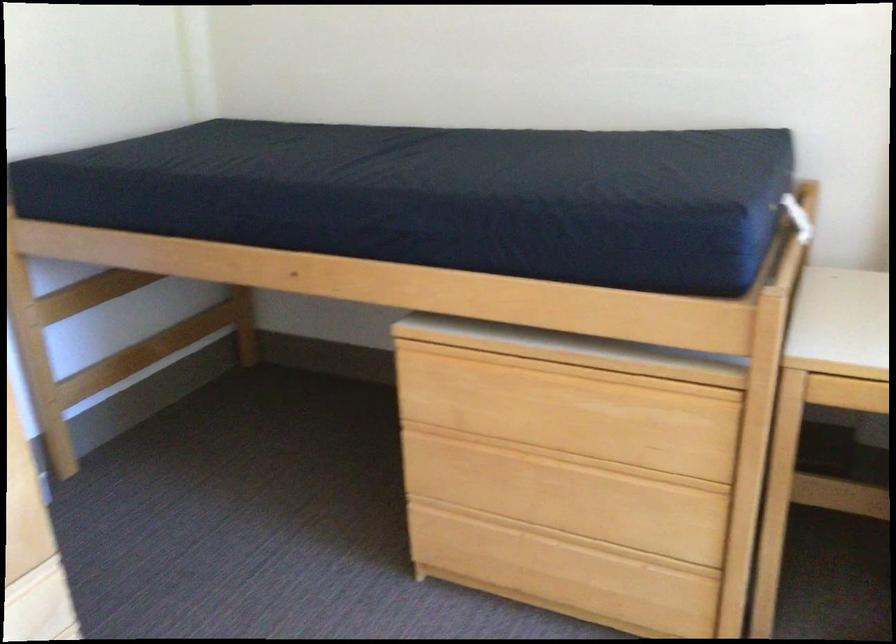
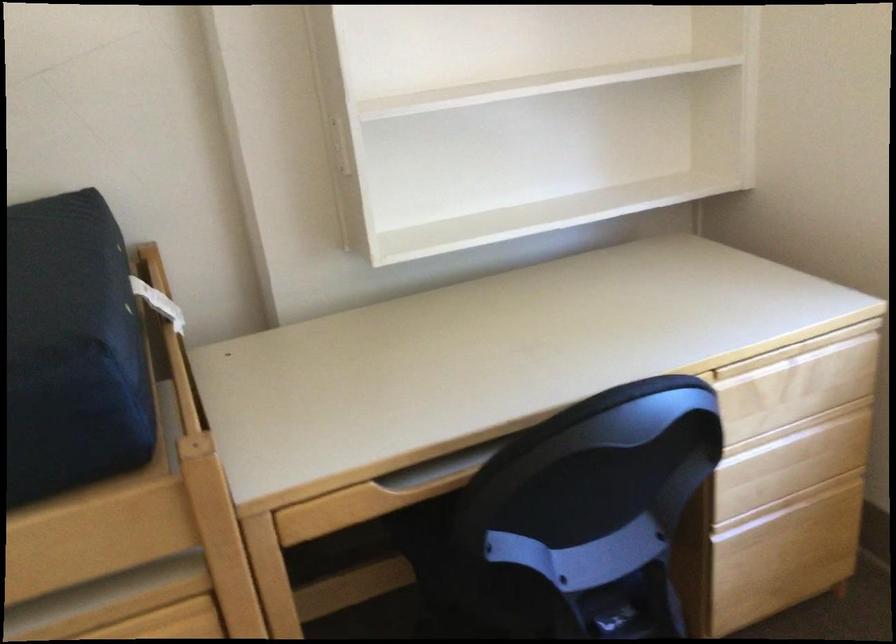
Question: The first image is from the beginning of the video and the second image is from the end. How did the camera likely rotate when shooting the video?

Choices:
 (A) Left
 (B) Right
 (C) Up
 (D) Down

Answer: (B)